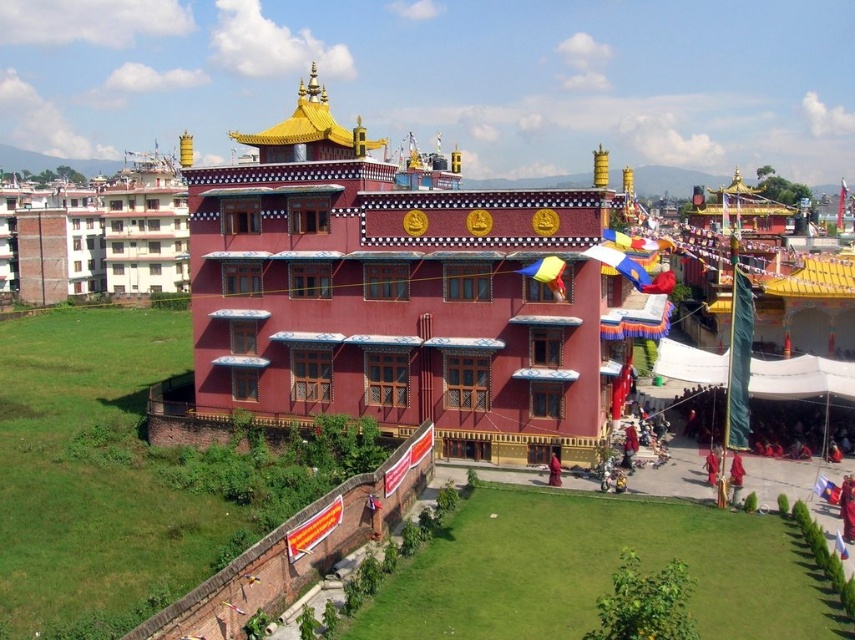
Is red velvet robe at lower right to the right of reddish-brown monk at lower center from the viewer's perspective?

Yes, red velvet robe at lower right is to the right of reddish-brown monk at lower center.

Can you confirm if red velvet robe at lower right is positioned to the left of reddish-brown monk at lower center?

Incorrect, red velvet robe at lower right is not on the left side of reddish-brown monk at lower center.

Is point (736, 483) less distant than point (547, 476)?

Yes, point (736, 483) is in front of point (547, 476).

The width and height of the screenshot is (855, 640). Find the location of `red velvet robe at lower right`. red velvet robe at lower right is located at coordinates (736, 477).

Does golden fabric robe at lower right appear on the right side of reddish-brown monk at lower center?

Yes, golden fabric robe at lower right is to the right of reddish-brown monk at lower center.

Where is `golden fabric robe at lower right`? golden fabric robe at lower right is located at coordinates (711, 465).

Where is `golden fabric robe at lower right`? The height and width of the screenshot is (640, 855). golden fabric robe at lower right is located at coordinates (711, 465).

Does matte red building at center appear over red velvet robe at lower right?

Yes.

Where is `matte red building at center`? The image size is (855, 640). matte red building at center is located at coordinates (398, 292).